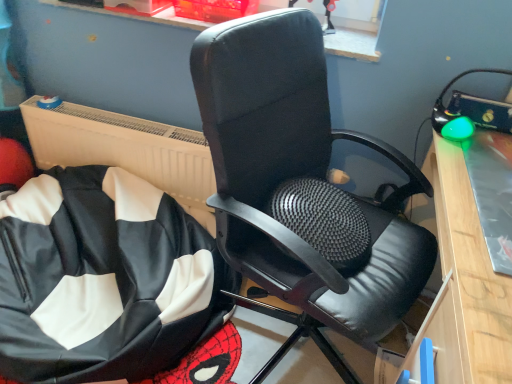
The width and height of the screenshot is (512, 384). What do you see at coordinates (106, 281) in the screenshot?
I see `black leather bean bag at lower left` at bounding box center [106, 281].

Locate an element on the screen. This screenshot has height=384, width=512. black leather bean bag at lower left is located at coordinates (106, 281).

Describe the element at coordinates (301, 188) in the screenshot. I see `black leather chair at center` at that location.

Find the location of a particular element. Image resolution: width=512 pixels, height=384 pixels. black leather chair at center is located at coordinates (301, 188).

Identify the location of black leather bean bag at lower left. (106, 281).

Considering the relative positions of black leather bean bag at lower left and black leather chair at center in the image provided, is black leather bean bag at lower left to the left of black leather chair at center from the viewer's perspective?

Correct, you'll find black leather bean bag at lower left to the left of black leather chair at center.

Is the position of black leather bean bag at lower left less distant than that of black leather chair at center?

No, black leather bean bag at lower left is further to the viewer.

Which is less distant, (x=42, y=269) or (x=327, y=233)?

Clearly, point (x=42, y=269) is more distant from the camera than point (x=327, y=233).

From the image's perspective, does black leather bean bag at lower left appear lower than black leather chair at center?

Yes, from the image's perspective, black leather bean bag at lower left is below black leather chair at center.

From a real-world perspective, who is located lower, black leather bean bag at lower left or black leather chair at center?

In real-world perspective, black leather bean bag at lower left is lower.

Which object is wider, black leather bean bag at lower left or black leather chair at center?

black leather bean bag at lower left.

Which of these two, black leather bean bag at lower left or black leather chair at center, stands shorter?

black leather bean bag at lower left.

Can you confirm if black leather bean bag at lower left is bigger than black leather chair at center?

No.

Can black leather chair at center be found inside black leather bean bag at lower left?

No.

Is black leather bean bag at lower left in contact with black leather chair at center?

No, black leather bean bag at lower left is not making contact with black leather chair at center.

Is black leather bean bag at lower left aimed at black leather chair at center?

No.

How many degrees apart are the facing directions of black leather bean bag at lower left and black leather chair at center?

The angular difference between black leather bean bag at lower left and black leather chair at center is 57.2 degrees.

In the image, there is a black leather chair at center. Where is `bean bag chair below it (from a real-world perspective)`? bean bag chair below it (from a real-world perspective) is located at coordinates (106, 281).

Does black leather chair at center appear on the left side of black leather bean bag at lower left?

No, black leather chair at center is not to the left of black leather bean bag at lower left.

Is the position of black leather chair at center more distant than that of black leather bean bag at lower left?

No.

Which is closer, (248, 177) or (46, 272)?

Clearly, point (248, 177) is closer to the camera than point (46, 272).

From the image's perspective, would you say black leather chair at center is shown under black leather bean bag at lower left?

Incorrect, from the image's perspective, black leather chair at center is higher than black leather bean bag at lower left.

From a real-world perspective, is black leather chair at center positioned over black leather bean bag at lower left based on gravity?

Yes.

Considering the sizes of objects black leather chair at center and black leather bean bag at lower left in the image provided, who is wider, black leather chair at center or black leather bean bag at lower left?

Wider between the two is black leather bean bag at lower left.

Which of these two, black leather chair at center or black leather bean bag at lower left, stands shorter?

black leather bean bag at lower left is shorter.

Looking at this image, can you confirm if black leather chair at center is bigger than black leather bean bag at lower left?

Indeed, black leather chair at center has a larger size compared to black leather bean bag at lower left.

Is black leather chair at center inside the boundaries of black leather bean bag at lower left, or outside?

The correct answer is: outside.

Is black leather chair at center with black leather bean bag at lower left?

No.

Is black leather chair at center turned away from black leather bean bag at lower left?

black leather chair at center does not have its back to black leather bean bag at lower left.

Locate an element on the screen. This screenshot has width=512, height=384. bean bag chair on the left of black leather chair at center is located at coordinates (106, 281).

Where is `chair that appears in front of the black leather bean bag at lower left`? This screenshot has height=384, width=512. chair that appears in front of the black leather bean bag at lower left is located at coordinates (301, 188).

I want to click on bean bag chair lying on the left of black leather chair at center, so click(106, 281).